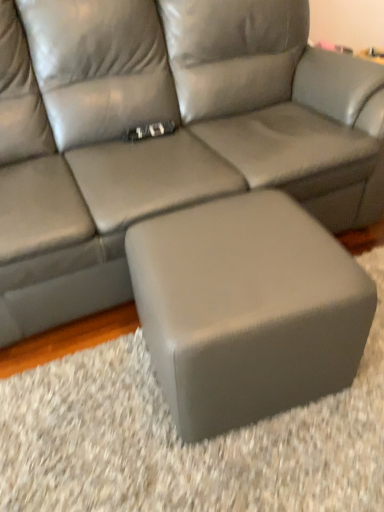
Question: Can you confirm if matte gray leather couch at center is shorter than matte gray ottoman at center?

Choices:
 (A) no
 (B) yes

Answer: (A)

Question: From a real-world perspective, is matte gray leather couch at center positioned over matte gray ottoman at center based on gravity?

Choices:
 (A) yes
 (B) no

Answer: (A)

Question: Is matte gray leather couch at center positioned in front of matte gray ottoman at center?

Choices:
 (A) yes
 (B) no

Answer: (A)

Question: Is matte gray leather couch at center bigger than matte gray ottoman at center?

Choices:
 (A) no
 (B) yes

Answer: (B)

Question: From the image's perspective, is matte gray leather couch at center under matte gray ottoman at center?

Choices:
 (A) yes
 (B) no

Answer: (B)

Question: Considering the relative sizes of matte gray leather couch at center and matte gray ottoman at center in the image provided, is matte gray leather couch at center taller than matte gray ottoman at center?

Choices:
 (A) no
 (B) yes

Answer: (B)

Question: From the image's perspective, does matte gray ottoman at center appear higher than matte gray leather couch at center?

Choices:
 (A) yes
 (B) no

Answer: (B)

Question: Are matte gray ottoman at center and matte gray leather couch at center making contact?

Choices:
 (A) no
 (B) yes

Answer: (A)

Question: Considering the relative sizes of matte gray ottoman at center and matte gray leather couch at center in the image provided, is matte gray ottoman at center shorter than matte gray leather couch at center?

Choices:
 (A) no
 (B) yes

Answer: (B)

Question: Is the position of matte gray ottoman at center less distant than that of matte gray leather couch at center?

Choices:
 (A) no
 (B) yes

Answer: (A)

Question: Is matte gray ottoman at center bigger than matte gray leather couch at center?

Choices:
 (A) no
 (B) yes

Answer: (A)

Question: Considering the relative sizes of matte gray ottoman at center and matte gray leather couch at center in the image provided, is matte gray ottoman at center thinner than matte gray leather couch at center?

Choices:
 (A) no
 (B) yes

Answer: (B)

Question: Would you say matte gray leather couch at center is to the left or to the right of matte gray ottoman at center in the picture?

Choices:
 (A) right
 (B) left

Answer: (B)